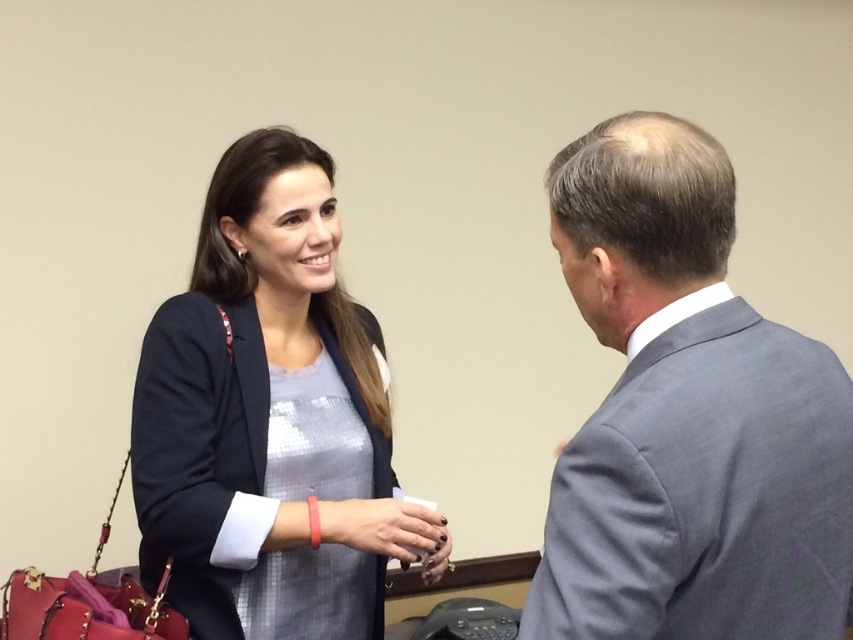
You are attending a business meeting and need to determine seating arrangements based on the image. Which object, the gray wool suit at right or the satin blue blazer at center, should be seated closer to the front of the room if taller individuals are to be placed there?

The satin blue blazer at center should be seated closer to the front since it has a greater height compared to the gray wool suit at right.

You are a photographer standing in the room. You need to capture a photo that includes both the gray wool suit at right and the satin blue blazer at center. What is the minimum distance you should position your camera from the subjects to ensure both are fully visible in the frame?

The minimum distance required is 27.15 inches, as that is the distance between the gray wool suit at right and the satin blue blazer at center, ensuring both are within the camera frame.